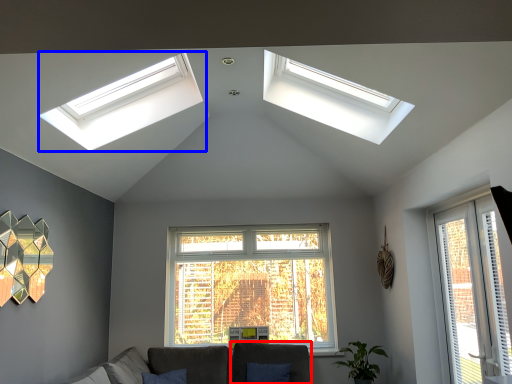
Question: Which object appears farthest to the camera in this image, armchair (highlighted by a red box) or window (highlighted by a blue box)?

Choices:
 (A) armchair
 (B) window

Answer: (A)